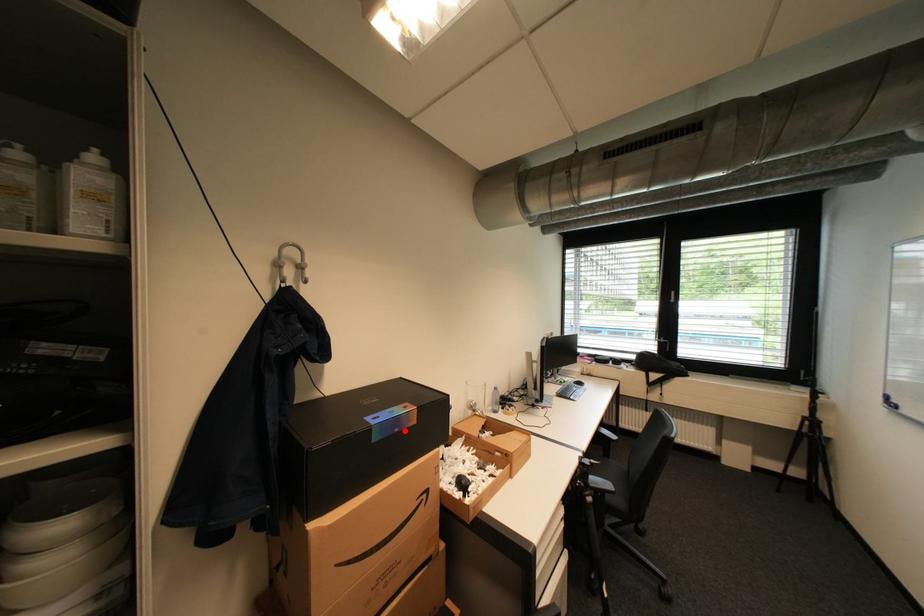
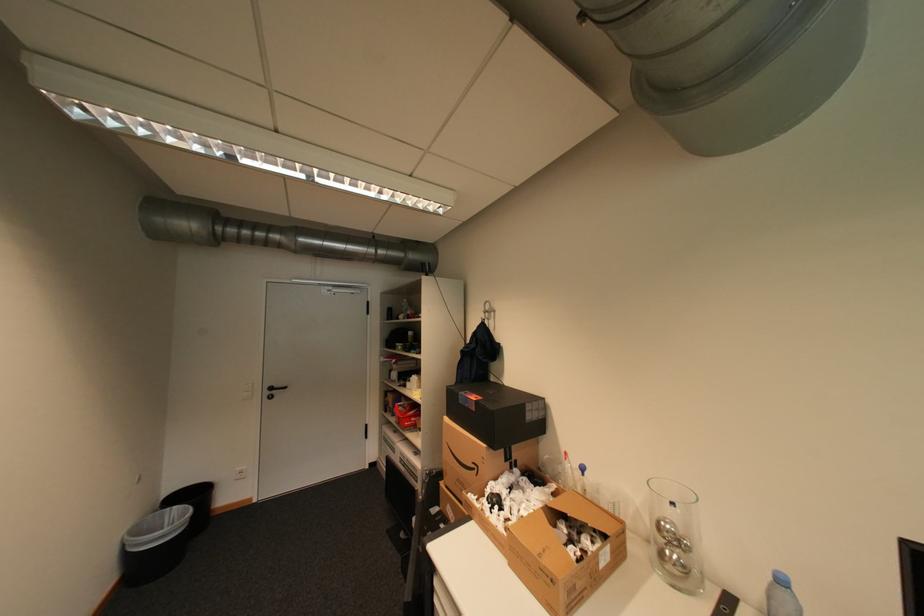
Question: I am providing you with two images of the same scene from different viewpoints. A red point is marked on the first image. At the location where the point appears in image 1, is it still visible in image 2?

Choices:
 (A) Yes
 (B) No

Answer: (A)